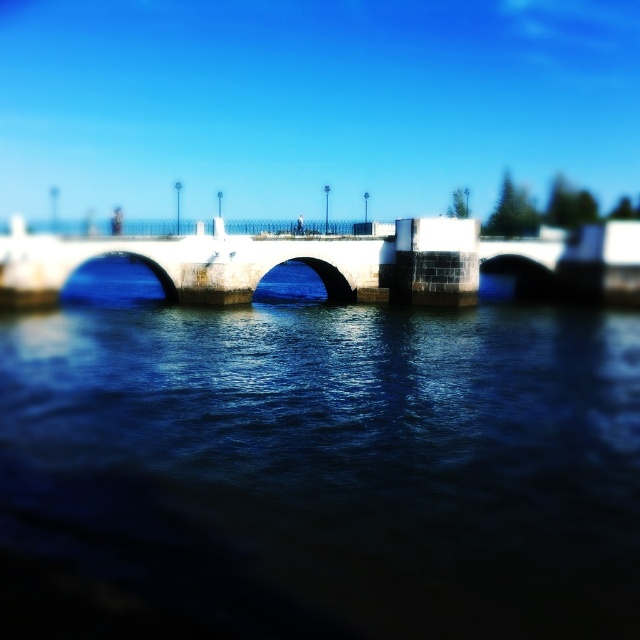
Question: Is dark blue water at center wider than white stone bridge at center?

Choices:
 (A) yes
 (B) no

Answer: (B)

Question: Which of the following is the farthest from the observer?

Choices:
 (A) white stone bridge at center
 (B) dark blue water at center

Answer: (A)

Question: From the image, what is the correct spatial relationship of dark blue water at center in relation to white stone bridge at center?

Choices:
 (A) left
 (B) right

Answer: (B)

Question: Does dark blue water at center have a smaller size compared to white stone bridge at center?

Choices:
 (A) yes
 (B) no

Answer: (A)